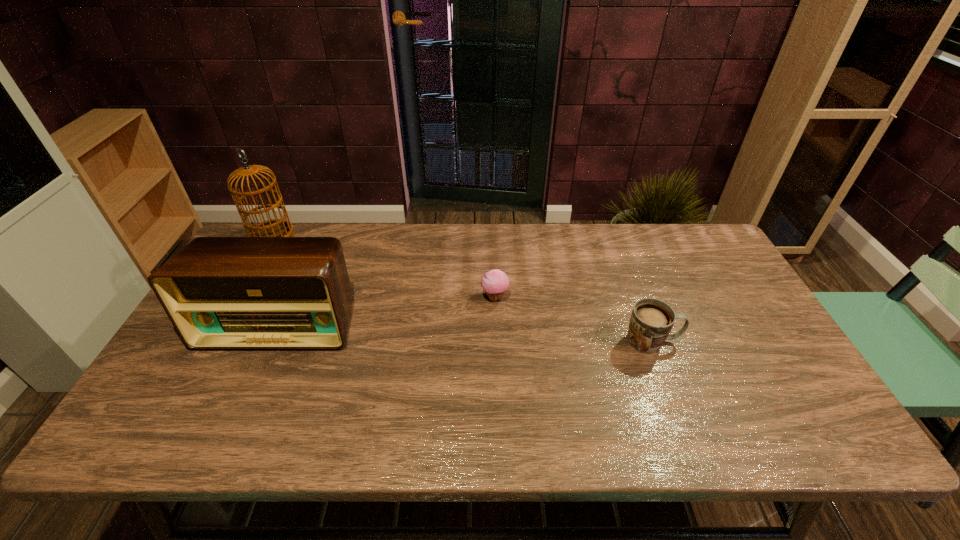
Where is `birdcage`? Image resolution: width=960 pixels, height=540 pixels. birdcage is located at coordinates (276, 227).

The width and height of the screenshot is (960, 540). In order to click on the tallest object in this screenshot , I will do `click(276, 227)`.

Identify the location of the third shortest object. Image resolution: width=960 pixels, height=540 pixels. (220, 293).

This screenshot has width=960, height=540. I want to click on the third tallest object, so click(651, 321).

Locate an element on the screen. Image resolution: width=960 pixels, height=540 pixels. mug is located at coordinates (651, 321).

Locate an element on the screen. The width and height of the screenshot is (960, 540). cupcake is located at coordinates (495, 282).

What are the coordinates of `the shortest object` in the screenshot? It's located at (495, 282).

Identify the location of free location located 0.330m on the front of the birdcage. (222, 326).

This screenshot has height=540, width=960. I want to click on vacant area located on the front-facing side of the radio receiver, so click(x=252, y=384).

Locate an element on the screen. This screenshot has width=960, height=540. vacant area situated 0.100m on the side of the rightmost object with the handle is located at coordinates (718, 341).